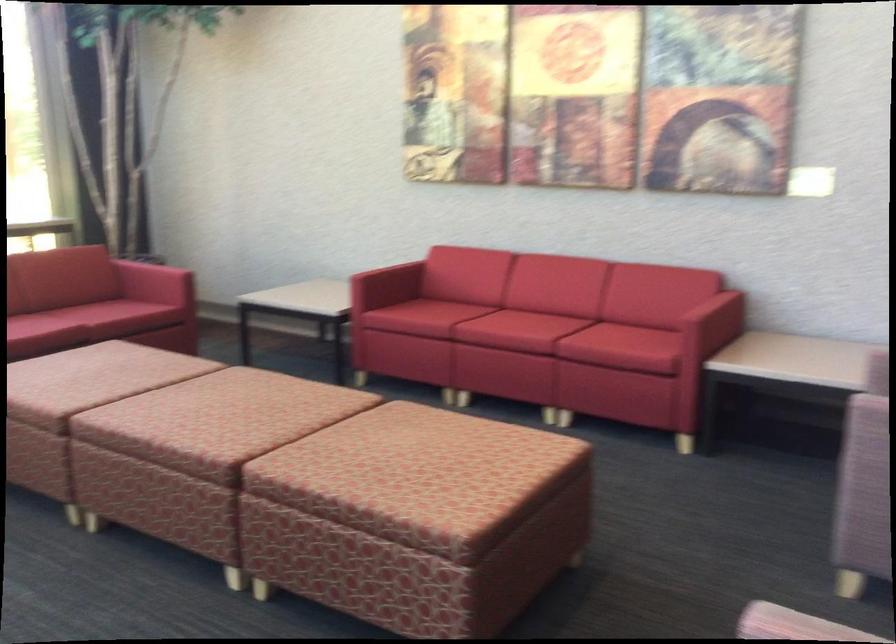
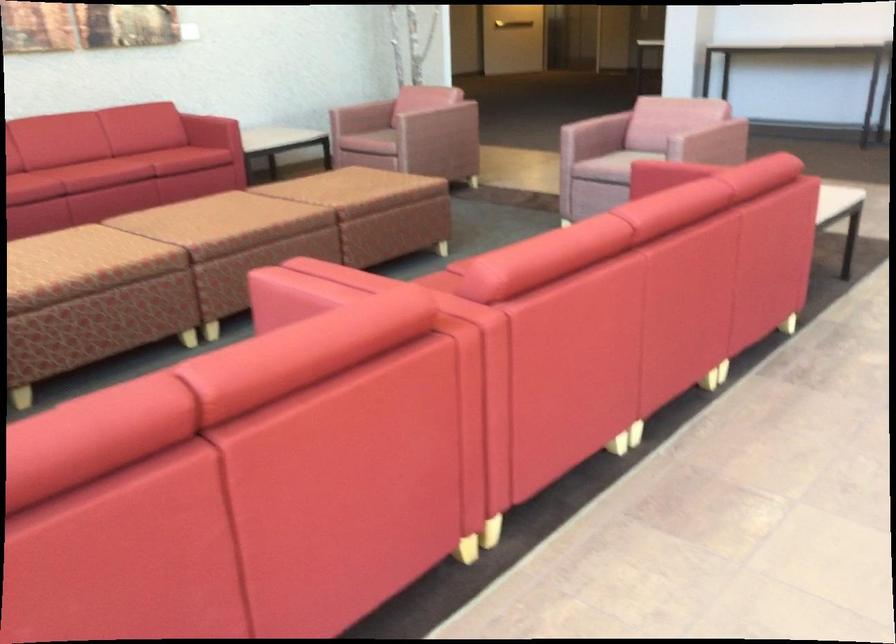
Question: I am providing you with two images of the same scene from different viewpoints. Please identify which objects are invisible in image2.

Choices:
 (A) patterned brown ottoman
 (B) red sofa armrest
 (C) pink chair armrest
 (D) none of these

Answer: (D)